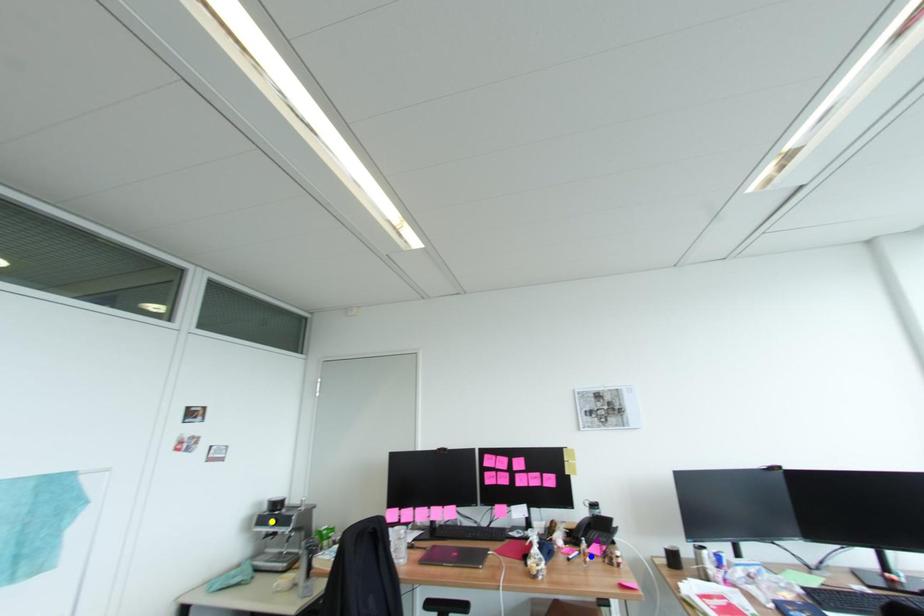
Order these from farthest to nearest:
A) blue point
B) purple point
C) yellow point

yellow point < purple point < blue point